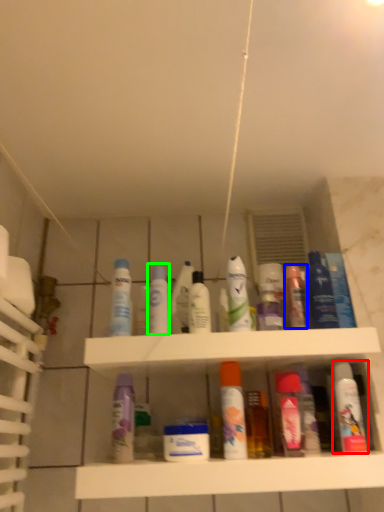
Question: Which object is positioned farthest from mouthwash (highlighted by a red box)? Select from toiletry (highlighted by a blue box) and mouthwash (highlighted by a green box).

Choices:
 (A) toiletry
 (B) mouthwash

Answer: (B)